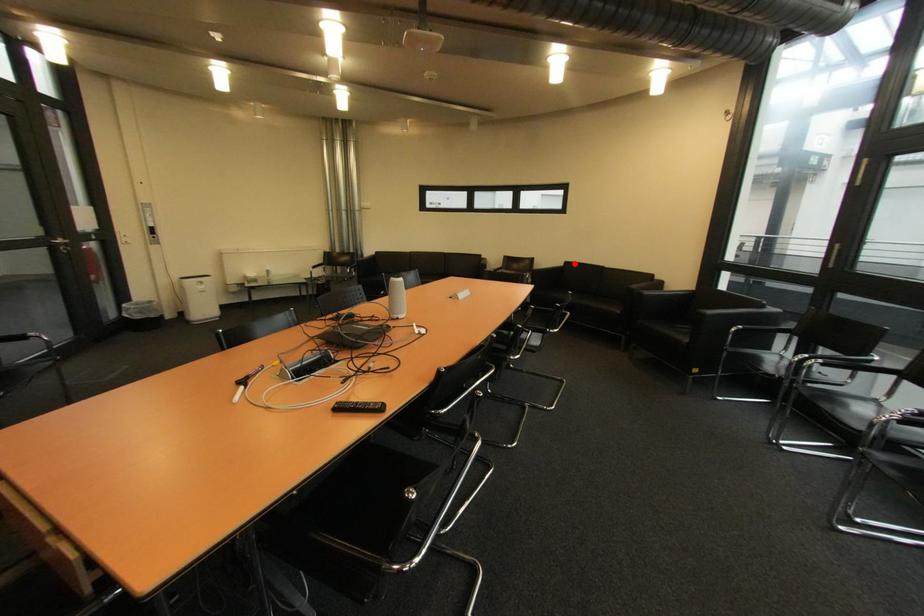
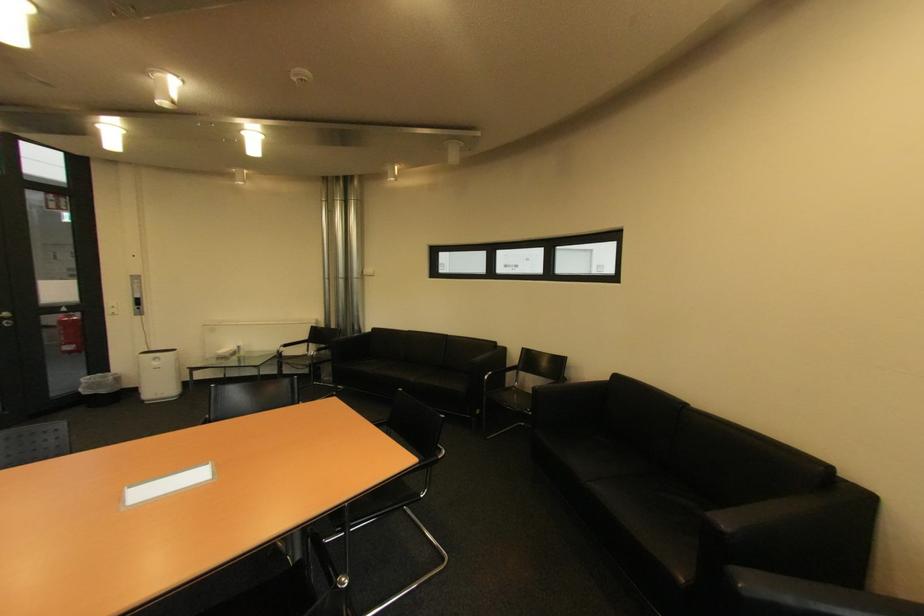
Where in the second image is the point corresponding to the highlighted location from the first image?

(625, 378)